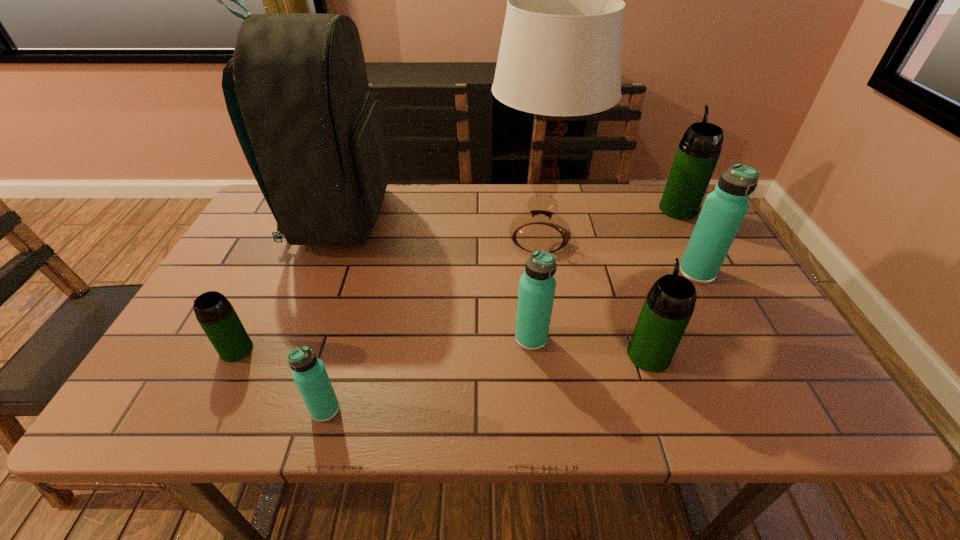
Identify the location of backpack that is at the left edge. (311, 131).

Locate an element on the screen. The height and width of the screenshot is (540, 960). thermos bottle at the left edge is located at coordinates (216, 315).

Where is `object situated at the far left corner`? The height and width of the screenshot is (540, 960). object situated at the far left corner is located at coordinates (311, 131).

Locate an element on the screen. The image size is (960, 540). object situated at the far right corner is located at coordinates (698, 152).

You are a GUI agent. You are given a task and a screenshot of the screen. Output one action in this format:
    pyautogui.click(x=<x>, y=<y>)
    Task: Click on the vacant region at the far edge of the desktop
    
    Given the screenshot: What is the action you would take?
    pyautogui.click(x=386, y=201)

The image size is (960, 540). What are the coordinates of `free space at the near edge` in the screenshot? It's located at point(293,410).

Image resolution: width=960 pixels, height=540 pixels. Find the location of `blank area at the right edge`. blank area at the right edge is located at coordinates coord(667,242).

Locate an element on the screen. This screenshot has height=540, width=960. free space at the far right corner of the desktop is located at coordinates (692, 227).

At what (x,y) coordinates should I click in order to perform the action: click on free spot at the near right corner of the desktop. Please return your answer as a coordinate pair (x, y). This screenshot has height=540, width=960. Looking at the image, I should click on (748, 382).

Find the location of a particular element. The height and width of the screenshot is (540, 960). vacant region between the smallest green thermos bottle and the gray backpack is located at coordinates (288, 284).